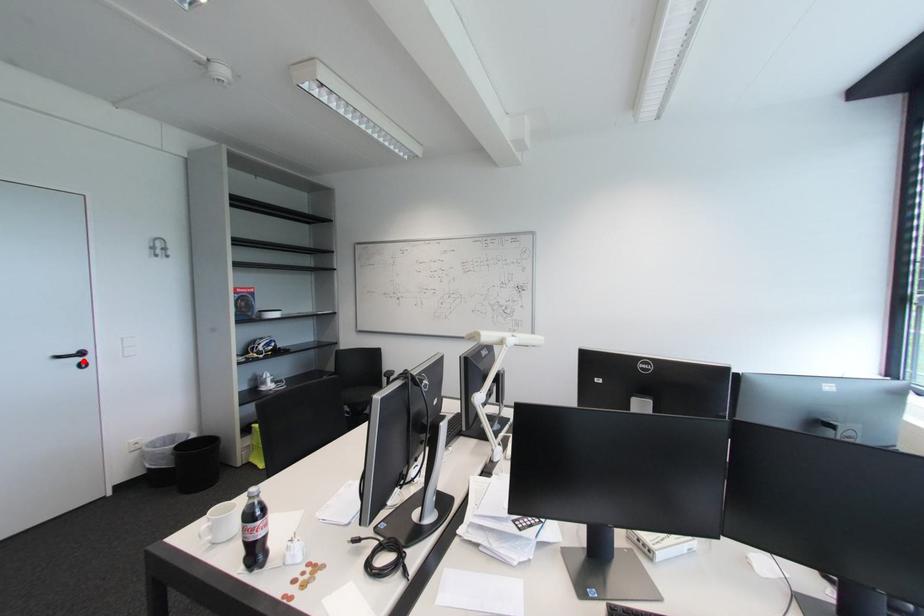
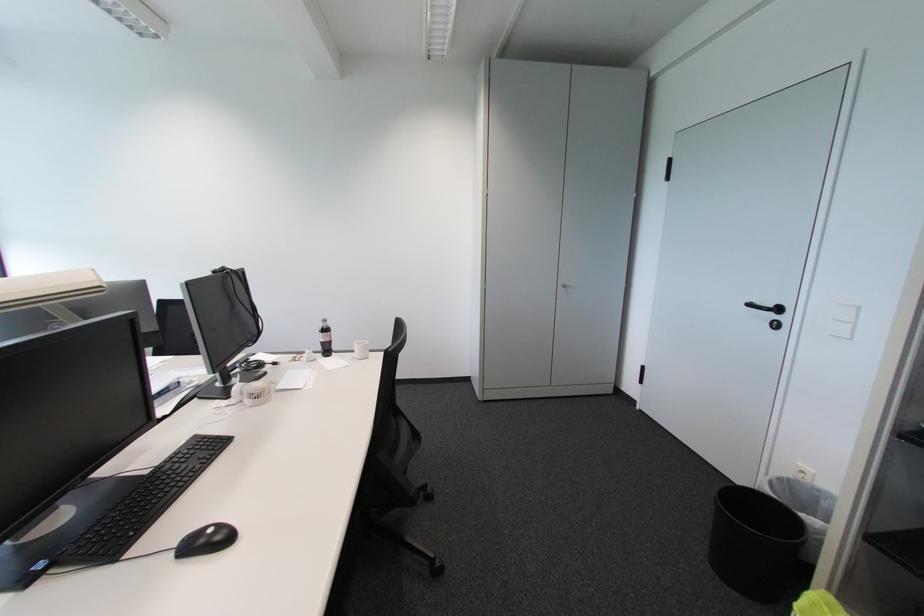
The point at the highlighted location is marked in the first image. Where is the corresponding point in the second image?

(777, 317)